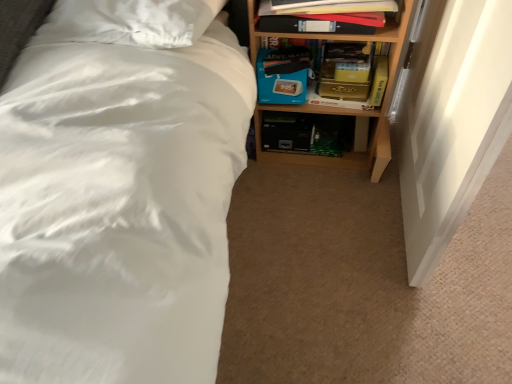
Question: Considering the relative sizes of matte black book at upper right, which is the first book from back to front, and wooden bookshelf at upper right in the image provided, is matte black book at upper right, which is the first book from back to front, shorter than wooden bookshelf at upper right?

Choices:
 (A) no
 (B) yes

Answer: (B)

Question: Does matte black book at upper right, which is the first book from back to front, appear on the right side of wooden bookshelf at upper right?

Choices:
 (A) yes
 (B) no

Answer: (B)

Question: Is matte black book at upper right, the 2th book viewed from the front, not within wooden bookshelf at upper right?

Choices:
 (A) yes
 (B) no

Answer: (B)

Question: Does matte black book at upper right, the 2th book viewed from the front, come behind wooden bookshelf at upper right?

Choices:
 (A) yes
 (B) no

Answer: (A)

Question: Could wooden bookshelf at upper right be considered to be inside matte black book at upper right, the 2th book viewed from the front?

Choices:
 (A) no
 (B) yes

Answer: (A)

Question: Based on their sizes in the image, would you say matte black book at upper right, positioned as the second book in back-to-front order, is bigger or smaller than yellow matte paperback book at right?

Choices:
 (A) small
 (B) big

Answer: (B)

Question: From a real-world perspective, is matte black book at upper right, positioned as the second book in back-to-front order, positioned above or below yellow matte paperback book at right?

Choices:
 (A) above
 (B) below

Answer: (A)

Question: Is matte black book at upper right, marked as the first book in a front-to-back arrangement, wider or thinner than yellow matte paperback book at right?

Choices:
 (A) thin
 (B) wide

Answer: (B)

Question: Is point (266, 21) closer or farther from the camera than point (387, 66)?

Choices:
 (A) closer
 (B) farther

Answer: (A)

Question: Considering the positions of blue cardboard box at center and wooden bookshelf at upper right in the image, is blue cardboard box at center wider or thinner than wooden bookshelf at upper right?

Choices:
 (A) thin
 (B) wide

Answer: (A)

Question: Is blue cardboard box at center inside the boundaries of wooden bookshelf at upper right, or outside?

Choices:
 (A) inside
 (B) outside

Answer: (A)

Question: From their relative heights in the image, would you say blue cardboard box at center is taller or shorter than wooden bookshelf at upper right?

Choices:
 (A) short
 (B) tall

Answer: (A)

Question: Considering the positions of blue cardboard box at center and wooden bookshelf at upper right in the image, is blue cardboard box at center bigger or smaller than wooden bookshelf at upper right?

Choices:
 (A) small
 (B) big

Answer: (A)

Question: From a real-world perspective, is blue cardboard box at center positioned above or below matte black book at upper right, the 2th book viewed from the front?

Choices:
 (A) above
 (B) below

Answer: (B)

Question: Is blue cardboard box at center taller or shorter than matte black book at upper right, which is the first book from back to front?

Choices:
 (A) short
 (B) tall

Answer: (A)